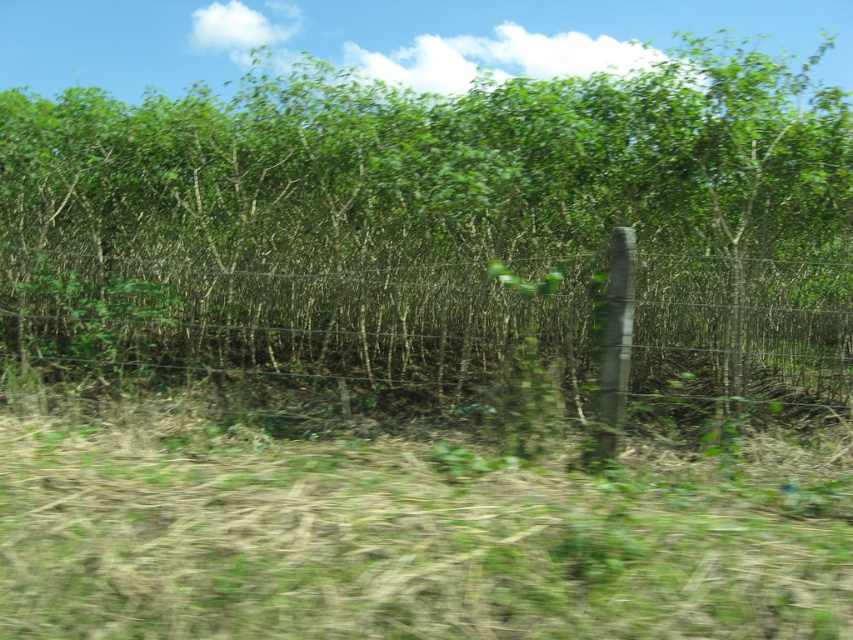
Question: Can you confirm if green leafy tree at center is thinner than green grass at lower center?

Choices:
 (A) yes
 (B) no

Answer: (A)

Question: Is green leafy tree at center wider than wire mesh fence at center?

Choices:
 (A) yes
 (B) no

Answer: (A)

Question: Is green leafy tree at center bigger than wire mesh fence at center?

Choices:
 (A) yes
 (B) no

Answer: (B)

Question: Estimate the real-world distances between objects in this image. Which object is closer to the green grass at lower center?

Choices:
 (A) wire mesh fence at center
 (B) green leafy tree at center

Answer: (A)

Question: Based on their relative distances, which object is farther from the green leafy tree at center?

Choices:
 (A) green grass at lower center
 (B) wire mesh fence at center

Answer: (A)

Question: Which of the following is the closest to the observer?

Choices:
 (A) (720, 182)
 (B) (283, 451)

Answer: (B)